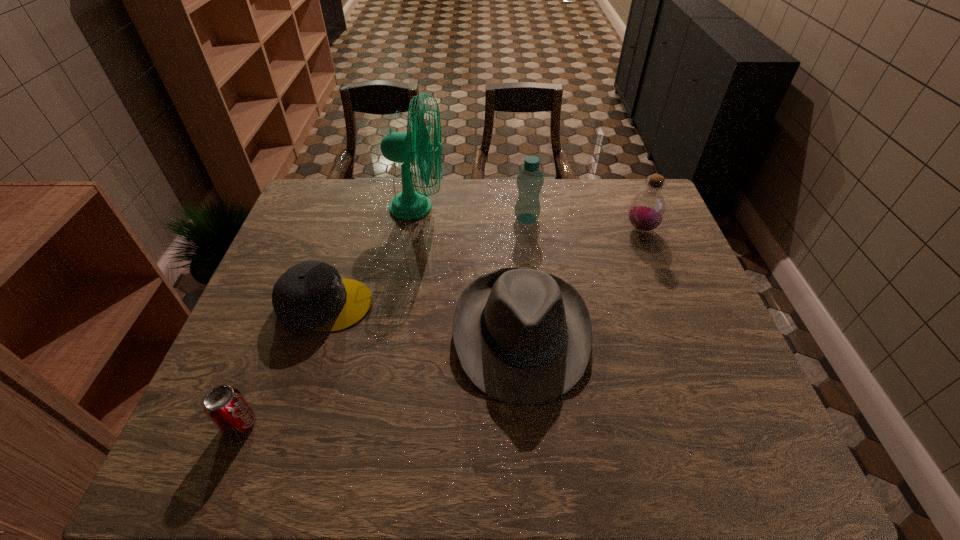
Locate an element on the screen. The height and width of the screenshot is (540, 960). vacant area at the near edge is located at coordinates (423, 450).

In the image, there is a desktop. Identify the location of vacant space at the left edge. (245, 394).

At what (x,y) coordinates should I click in order to perform the action: click on free space at the right edge. Please return your answer as a coordinate pair (x, y). Looking at the image, I should click on pos(705,312).

This screenshot has height=540, width=960. What are the coordinates of `free space at the far left corner of the desktop` in the screenshot? It's located at (305, 217).

Find the location of a particular element. vacant area at the far right corner is located at coordinates (639, 179).

Locate an element on the screen. free space at the near right corner of the desktop is located at coordinates (762, 460).

This screenshot has width=960, height=540. Find the location of `free space between the nearest object and the left bottle`. free space between the nearest object and the left bottle is located at coordinates (383, 321).

Image resolution: width=960 pixels, height=540 pixels. What are the coordinates of `vacant space that is in between the cap and the fedora` in the screenshot? It's located at (423, 319).

Image resolution: width=960 pixels, height=540 pixels. I want to click on blank region between the fedora and the cap, so click(x=423, y=319).

At what (x,y) coordinates should I click in order to perform the action: click on blank region between the left bottle and the right bottle. Please return your answer as a coordinate pair (x, y). Image resolution: width=960 pixels, height=540 pixels. Looking at the image, I should click on (584, 224).